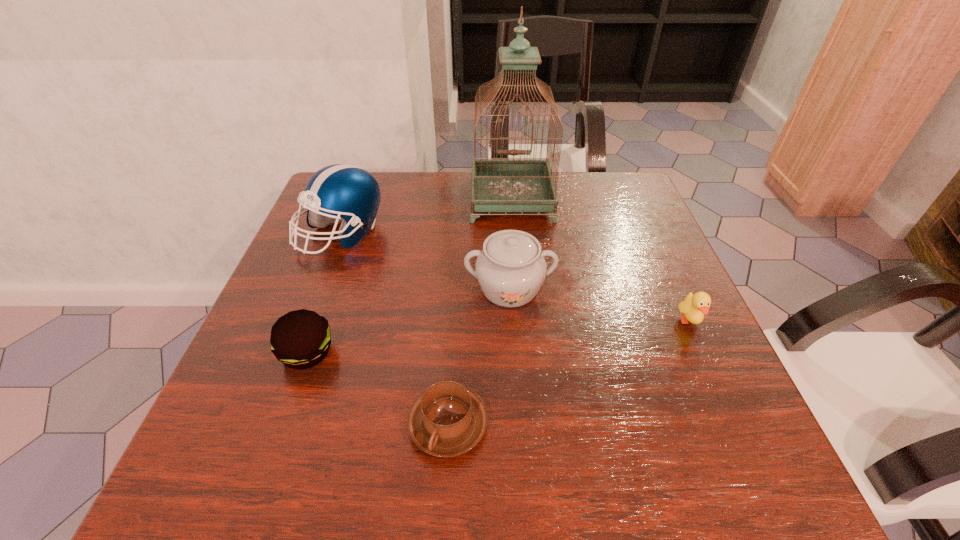
This screenshot has height=540, width=960. I want to click on vacant space located on the back of the patty, so click(x=342, y=254).

The width and height of the screenshot is (960, 540). Identify the location of vacant space located 0.180m on the front-facing side of the rightmost object. (736, 423).

Identify the location of birdcage at the far edge. The width and height of the screenshot is (960, 540). (502, 184).

At what (x,y) coordinates should I click in order to perform the action: click on football helmet present at the far edge. Please return your answer as a coordinate pair (x, y). The image size is (960, 540). Looking at the image, I should click on (341, 190).

Image resolution: width=960 pixels, height=540 pixels. What are the coordinates of `object present at the near edge` in the screenshot? It's located at 448,419.

This screenshot has height=540, width=960. Identify the location of football helmet that is at the left edge. (341, 190).

Where is `patty that is positioned at the left edge`? The width and height of the screenshot is (960, 540). patty that is positioned at the left edge is located at coordinates (300, 339).

This screenshot has width=960, height=540. I want to click on object present at the right edge, so click(693, 307).

Locate an element on the screen. This screenshot has height=540, width=960. object positioned at the far left corner is located at coordinates (341, 190).

At what (x,y) coordinates should I click in order to perform the action: click on vacant space at the far edge of the desktop. Please return your answer as a coordinate pair (x, y). Looking at the image, I should click on (388, 173).